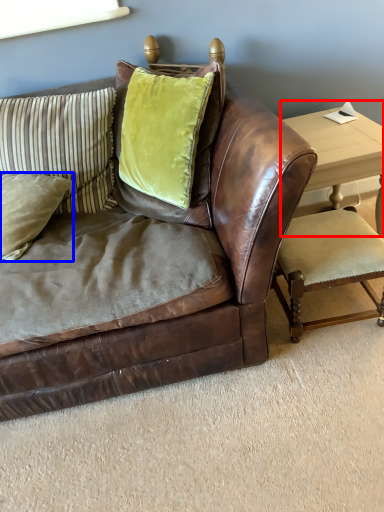
Question: Among these objects, which one is farthest to the camera, table (highlighted by a red box) or pillow (highlighted by a blue box)?

Choices:
 (A) table
 (B) pillow

Answer: (A)